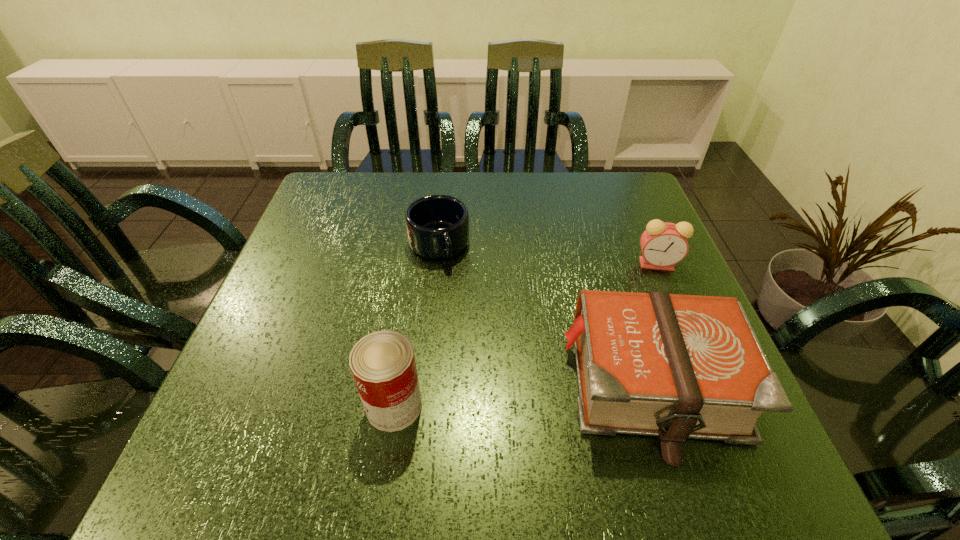
Find the location of a particular element. free spot between the mug and the alarm clock is located at coordinates (547, 254).

Locate an element on the screen. This screenshot has width=960, height=540. free space between the mug and the Bible is located at coordinates (545, 315).

The width and height of the screenshot is (960, 540). I want to click on free space between the Bible and the tallest object, so click(x=523, y=396).

This screenshot has width=960, height=540. Identify the location of free space between the mug and the can. [x=417, y=325].

At what (x,y) coordinates should I click in order to perform the action: click on unoccupied area between the tallest object and the shortest object. Please return your answer as a coordinate pair (x, y). The height and width of the screenshot is (540, 960). Looking at the image, I should click on (417, 325).

Identify which object is the third closest to the can. Please provide its 2D coordinates. Your answer should be formatted as a tuple, i.e. [(x, y)], where the tuple contains the x and y coordinates of a point satisfying the conditions above.

[(663, 244)]

Where is `object that can be found as the closest to the shortest object`? Image resolution: width=960 pixels, height=540 pixels. object that can be found as the closest to the shortest object is located at coordinates (674, 366).